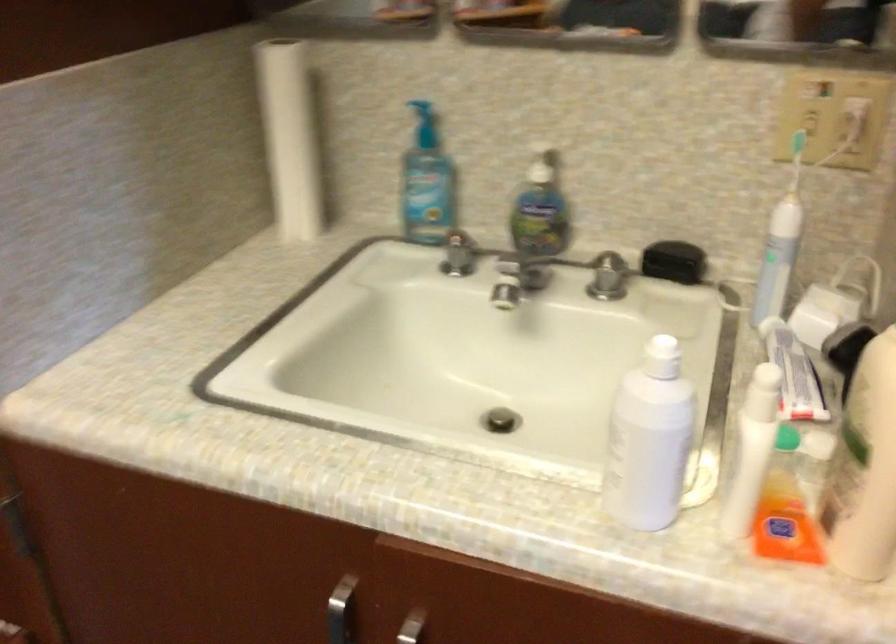
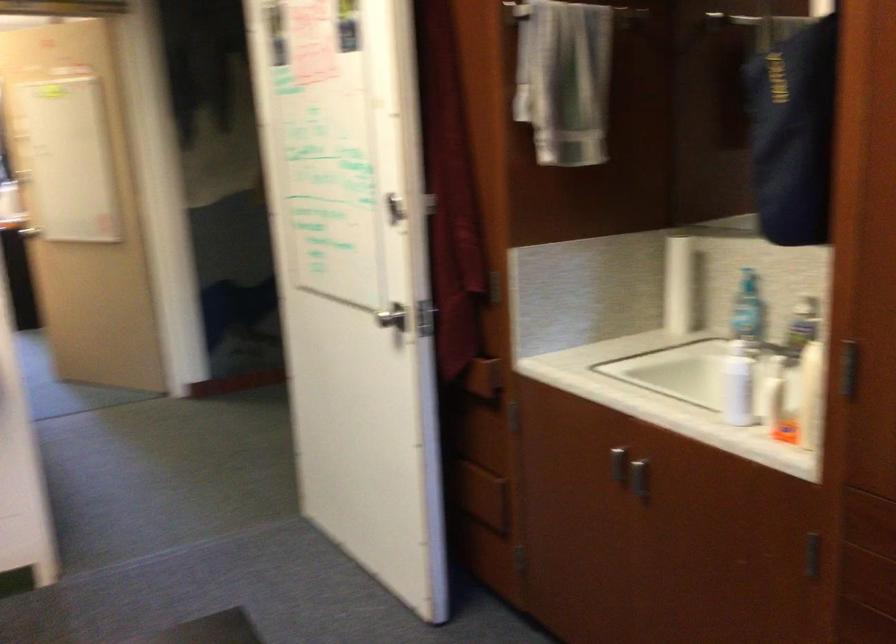
Question: I am providing you with two images of the same scene from different viewpoints. Which of the following objects are not visible in image2?

Choices:
 (A) white file box
 (B) silver faucet handle
 (C) white plastic bottle
 (D) recessed drawer pull

Answer: (B)